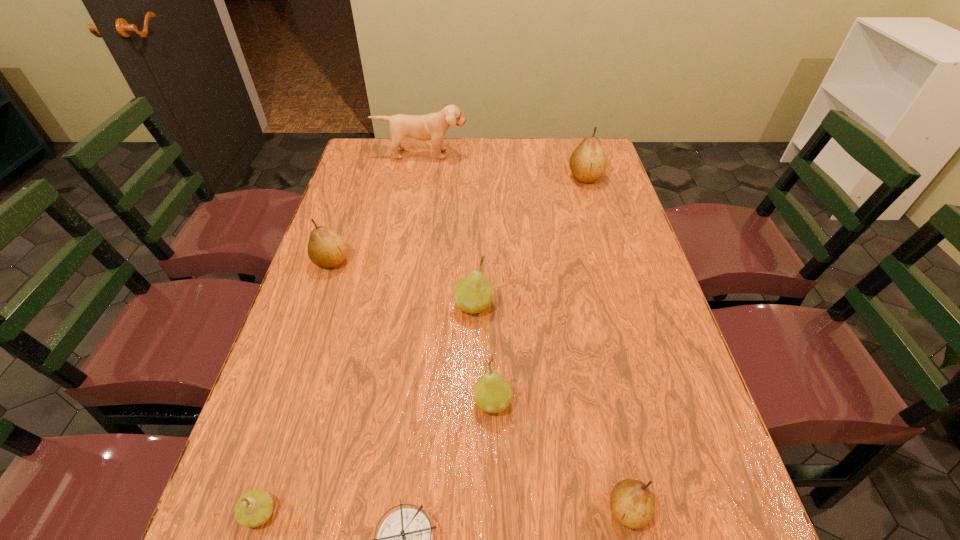
You are a GUI agent. You are given a task and a screenshot of the screen. Output one action in this format:
    pyautogui.click(x=<x>, y=<y>)
    Task: Click on the free space between the biggest green pear and the smallest green pear
    
    Given the screenshot: What is the action you would take?
    pyautogui.click(x=367, y=409)

What are the coordinates of `vacant space in between the second pear from right to left and the biggest green pear` in the screenshot? It's located at (551, 407).

Locate an element on the screen. Image resolution: width=960 pixels, height=540 pixels. free point between the puppy and the biggest brown pear is located at coordinates (503, 165).

Where is `free space between the fifth pear from left to right and the nearest green pear`? The height and width of the screenshot is (540, 960). free space between the fifth pear from left to right and the nearest green pear is located at coordinates (444, 511).

The height and width of the screenshot is (540, 960). I want to click on vacant space in between the fifth pear from left to right and the puppy, so click(x=524, y=332).

Identify the location of vacant area between the rightmost object and the leftmost green pear. This screenshot has width=960, height=540. (422, 345).

The height and width of the screenshot is (540, 960). What are the coordinates of `object that ranks as the seventh closest to the beige puppy` in the screenshot? It's located at (405, 539).

Select which object appears as the sixth closest to the rightmost brown pear. Please provide its 2D coordinates. Your answer should be formatted as a tuple, i.e. [(x, y)], where the tuple contains the x and y coordinates of a point satisfying the conditions above.

[(405, 539)]

Locate an element on the screen. The image size is (960, 540). pear identified as the fifth closest to the farthest pear is located at coordinates (253, 509).

Locate an element on the screen. This screenshot has height=540, width=960. pear that is the second closest to the fourth farthest pear is located at coordinates (632, 504).